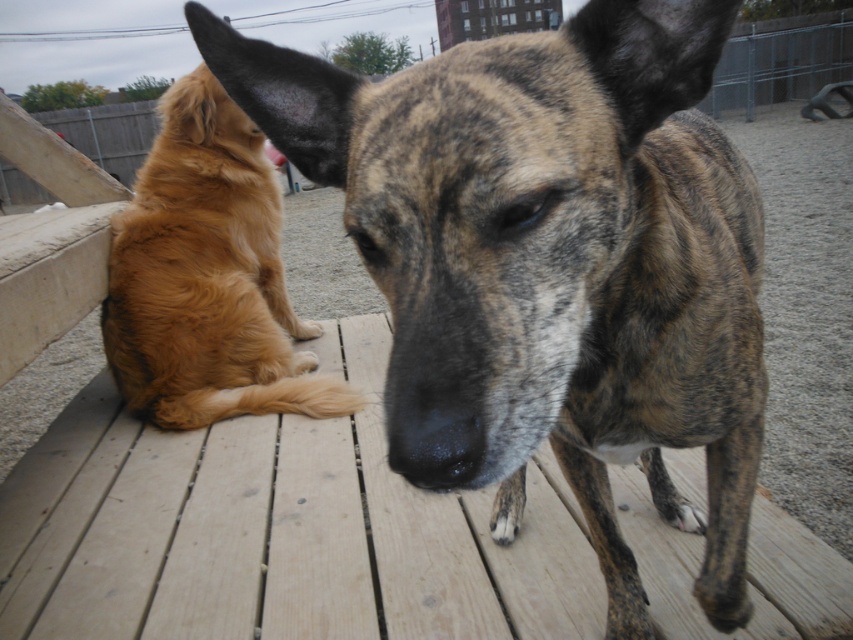
How distant is brindle fur dog at center from black smooth nose at center?

brindle fur dog at center is 18.68 inches away from black smooth nose at center.

Does point (554, 220) come behind point (462, 461)?

Yes, point (554, 220) is farther from viewer.

Locate an element on the screen. brindle fur dog at center is located at coordinates (554, 256).

How distant is golden fur dog at left from black smooth nose at center?

golden fur dog at left is 7.95 feet away from black smooth nose at center.

You are a GUI agent. You are given a task and a screenshot of the screen. Output one action in this format:
    pyautogui.click(x=<x>, y=<y>)
    Task: Click on the golden fur dog at left
    The width and height of the screenshot is (853, 640).
    Given the screenshot: What is the action you would take?
    pyautogui.click(x=207, y=276)

Which is in front, point (474, 268) or point (224, 182)?

Point (474, 268) is more forward.

Is brindle fur dog at center below golden fur dog at left?

Yes.

Who is more distant from viewer, (572, 449) or (194, 154)?

Positioned behind is point (194, 154).

The image size is (853, 640). Find the location of `brindle fur dog at center`. brindle fur dog at center is located at coordinates (554, 256).